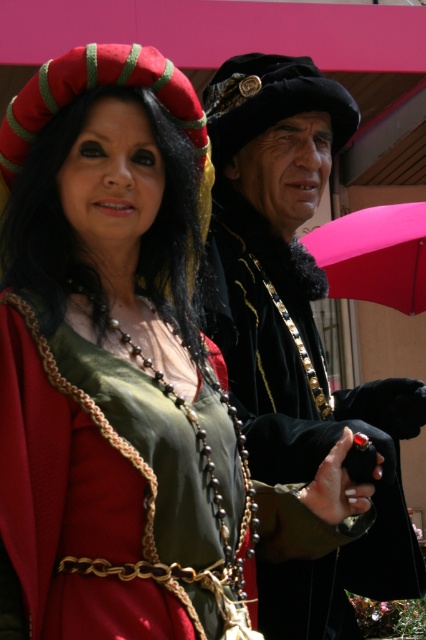
You are standing at the point marked by the coordinate point at (394, 538). You want to walk to the person on the right. Which direction should you go?

Since the two people are 18.91 meters apart, you should walk towards the person on the right from the point at (394, 538).

What is the exact location of the velvet black coat at center in the image?

The velvet black coat at center is located at point coordinates of (299, 333).

You are an event planner organizing a photoshoot for the attendees of a historical festival. You need to decide whether the green satin dress at center can be placed next to the pink fabric umbrella at upper right without overlapping. Based on their widths, can they fit side by side in the designated space?

The green satin dress at center has a lesser width compared to the pink fabric umbrella at upper right. Since the dress is narrower, they can fit side by side as long as the total width of both items does not exceed the available space.